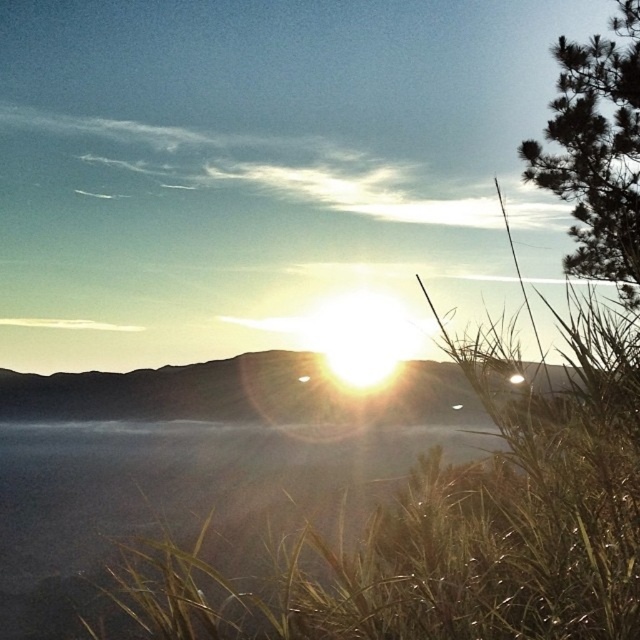
Question: Can you confirm if sandy brown hillside at center is positioned to the left of green leafy tree at upper right?

Choices:
 (A) yes
 (B) no

Answer: (A)

Question: Does sandy brown hillside at center have a greater width compared to green leafy tree at upper right?

Choices:
 (A) yes
 (B) no

Answer: (A)

Question: Which point is farther to the camera?

Choices:
 (A) sandy brown hillside at center
 (B) green leafy tree at upper right

Answer: (B)

Question: Is sandy brown hillside at center smaller than green leafy tree at upper right?

Choices:
 (A) yes
 (B) no

Answer: (B)

Question: Which object appears closest to the camera in this image?

Choices:
 (A) sandy brown hillside at center
 (B) green leafy tree at upper right

Answer: (A)

Question: Which point is closer to the camera taking this photo?

Choices:
 (A) (627, 196)
 (B) (433, 362)

Answer: (A)